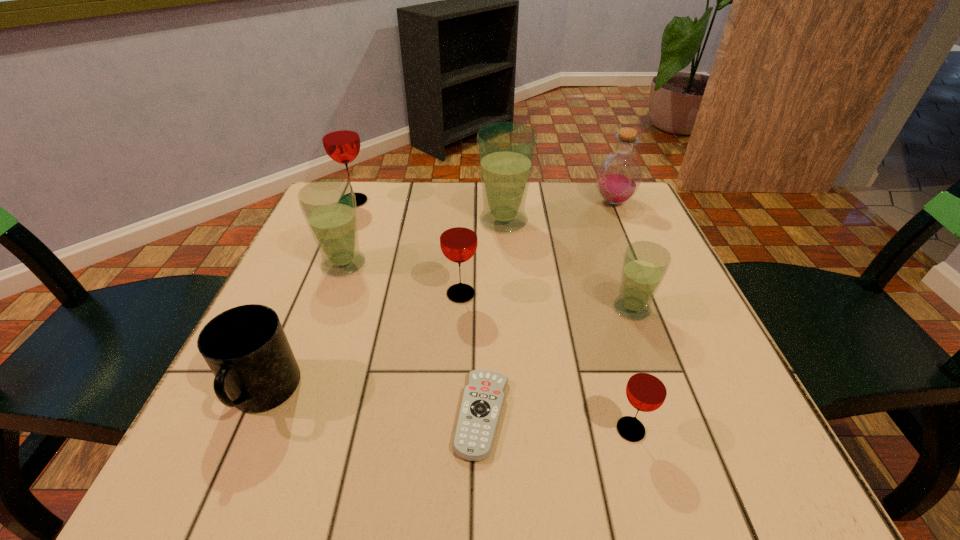
Locate an element on the screen. glass object that ranks as the second closest to the second blue glass from left to right is located at coordinates (645, 264).

Select which glass appears as the fifth closest to the farthest red glass. Please provide its 2D coordinates. Your answer should be formatted as a tuple, i.e. [(x, y)], where the tuple contains the x and y coordinates of a point satisfying the conditions above.

[(646, 390)]

This screenshot has width=960, height=540. Find the location of `the third closest red glass to the shortest object`. the third closest red glass to the shortest object is located at coordinates (340, 137).

Where is `red glass identified as the second closest to the leftmost blue glass`? The image size is (960, 540). red glass identified as the second closest to the leftmost blue glass is located at coordinates (458, 238).

Where is `blue glass that can be found as the second closest to the second nearest red glass`? Image resolution: width=960 pixels, height=540 pixels. blue glass that can be found as the second closest to the second nearest red glass is located at coordinates (329, 205).

Point out which blue glass is positioned as the second nearest to the smallest blue glass. Please provide its 2D coordinates. Your answer should be formatted as a tuple, i.e. [(x, y)], where the tuple contains the x and y coordinates of a point satisfying the conditions above.

[(329, 205)]

What are the coordinates of `vacant area that satisfies the following two spatial constraints: 1. on the front side of the second farthest blue glass; 2. on the right side of the nearest blue glass` in the screenshot? It's located at (327, 309).

Locate an element on the screen. Image resolution: width=960 pixels, height=540 pixels. free location that satisfies the following two spatial constraints: 1. on the back side of the second smallest red glass; 2. on the right side of the farthest blue glass is located at coordinates [465, 221].